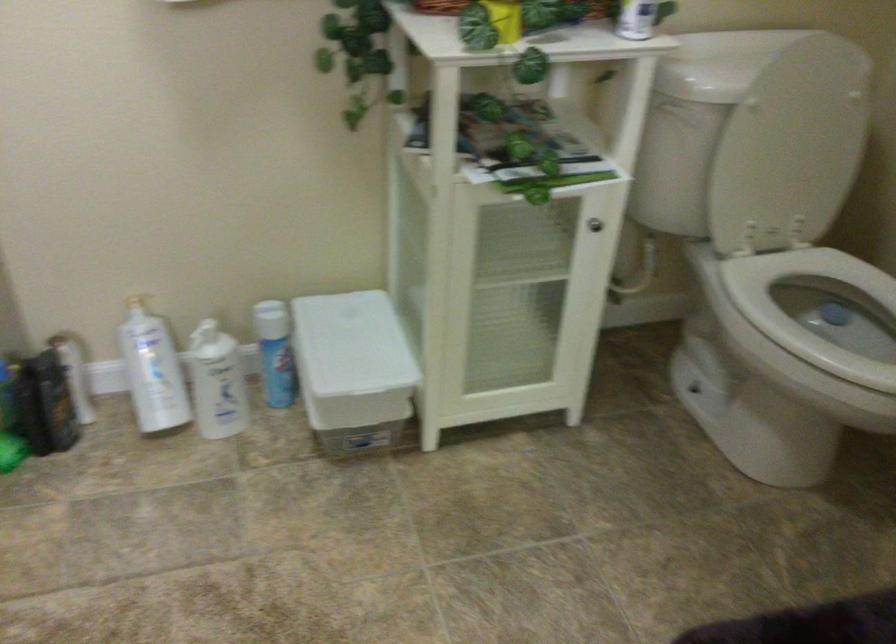
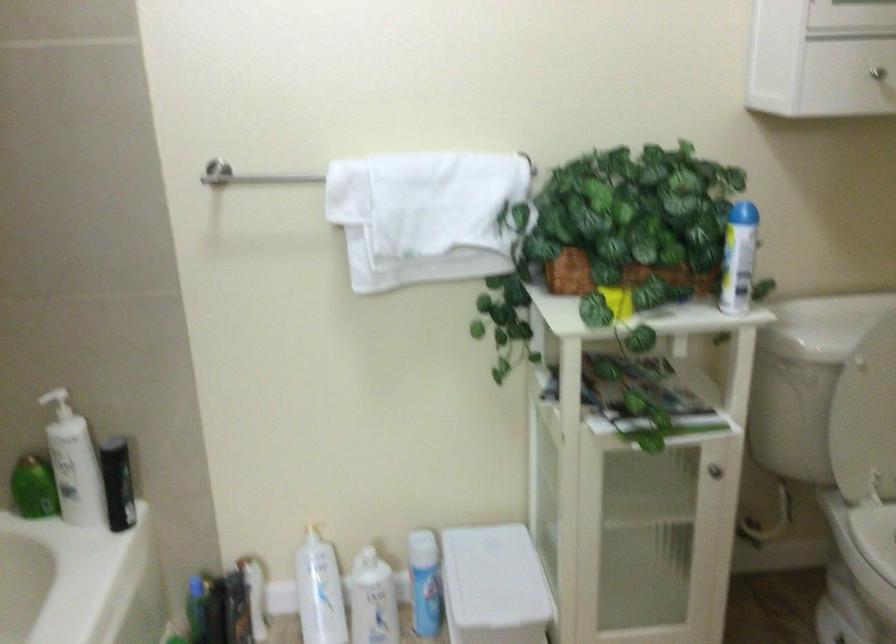
Where in the second image is the point corresponding to (750,164) from the first image?

(865, 413)